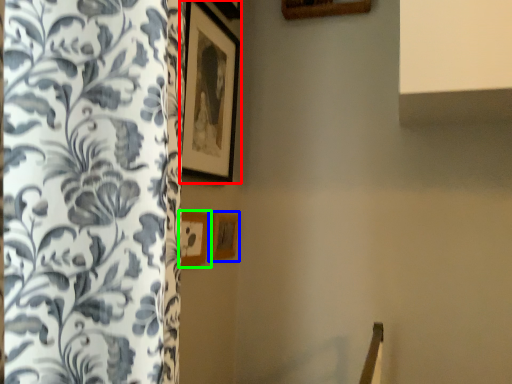
Question: Which object is positioned closest to picture frame (highlighted by a red box)? Select from picture frame (highlighted by a blue box) and picture frame (highlighted by a green box).

Choices:
 (A) picture frame
 (B) picture frame

Answer: (B)